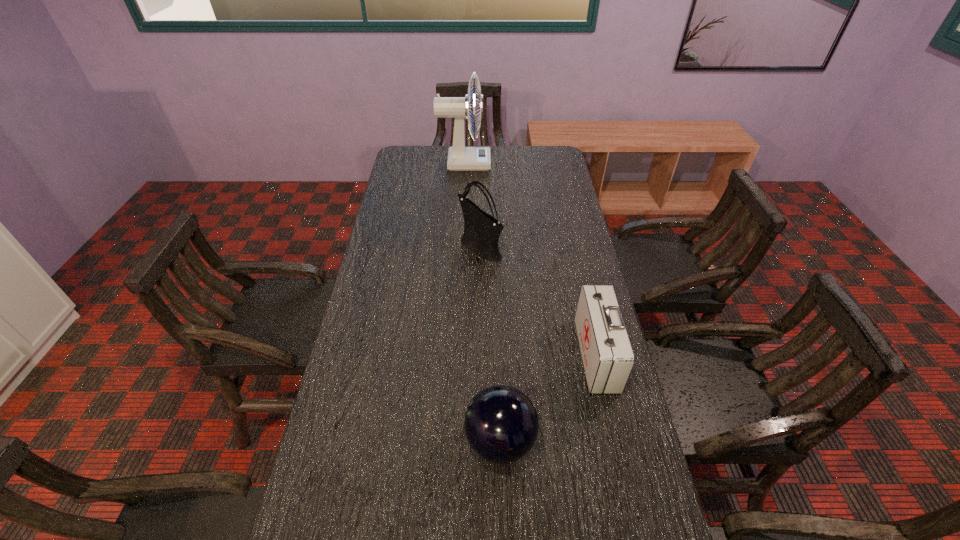
Locate an element on the screen. The height and width of the screenshot is (540, 960). vacant space located on the side of the bowling ball with the finger holes is located at coordinates (407, 441).

Where is `free region located on the side of the bowling ball with the finger holes`? This screenshot has height=540, width=960. free region located on the side of the bowling ball with the finger holes is located at coordinates (415, 441).

Find the location of `blank area located on the front-facing side of the second nearest object`. blank area located on the front-facing side of the second nearest object is located at coordinates tap(535, 355).

Find the location of a particular element. The width and height of the screenshot is (960, 540). blank space located 0.250m on the front-facing side of the second nearest object is located at coordinates 492,355.

The image size is (960, 540). I want to click on vacant space situated 0.400m on the front-facing side of the second nearest object, so click(439, 355).

Locate an element on the screen. object at the far edge is located at coordinates (460, 158).

This screenshot has width=960, height=540. I want to click on object located in the right edge section of the desktop, so click(x=608, y=358).

The height and width of the screenshot is (540, 960). In order to click on free space at the far edge in this screenshot , I will do `click(521, 154)`.

In order to click on vacant space at the left edge of the desktop in this screenshot , I will do `click(324, 439)`.

Where is `vacant area at the right edge`? vacant area at the right edge is located at coordinates (547, 180).